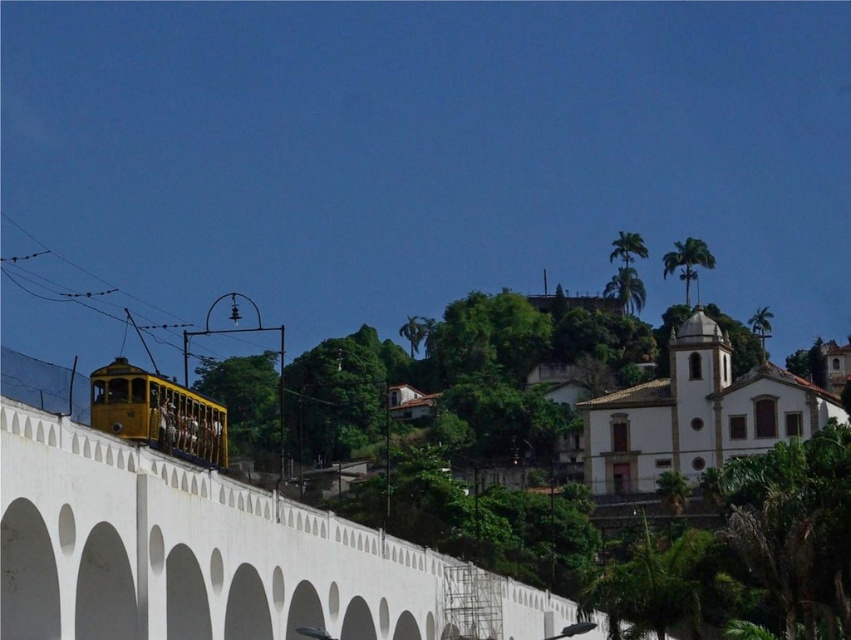
Question: Does white concrete bridge at lower left appear under yellow polished metal tram at lower left?

Choices:
 (A) no
 (B) yes

Answer: (B)

Question: From the image, what is the correct spatial relationship of white concrete bridge at lower left in relation to yellow polished metal tram at lower left?

Choices:
 (A) left
 (B) right

Answer: (B)

Question: Which object is farther from the camera taking this photo?

Choices:
 (A) white concrete bridge at lower left
 (B) yellow polished metal tram at lower left

Answer: (B)

Question: Where is white concrete bridge at lower left located in relation to yellow polished metal tram at lower left in the image?

Choices:
 (A) above
 (B) below

Answer: (B)